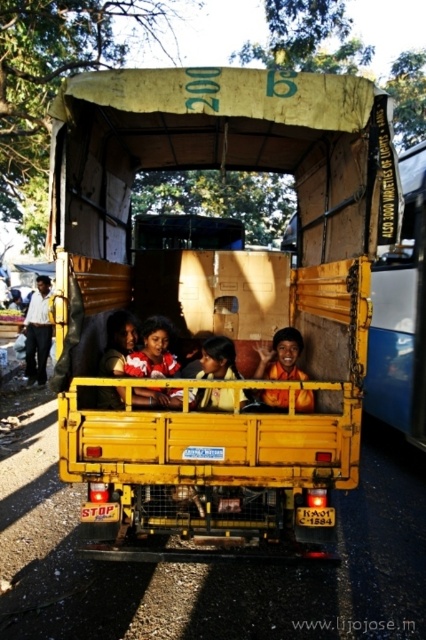
Can you confirm if red and white striped shirt at center is bigger than white cotton shirt at left?

Yes.

Who is shorter, red and white striped shirt at center or white cotton shirt at left?

With less height is white cotton shirt at left.

Is point (144, 323) more distant than point (46, 346)?

No, (144, 323) is closer to viewer.

Identify the location of red and white striped shirt at center. (152, 352).

Is orange cloth at center positioned behind white cotton shirt at left?

No, orange cloth at center is closer to the viewer.

Between point (294, 333) and point (36, 324), which one is positioned in front?

Positioned in front is point (294, 333).

Is point (258, 353) positioned behind point (40, 378)?

No, (258, 353) is closer to viewer.

Locate an element on the screen. orange cloth at center is located at coordinates (281, 356).

Does matte yellow shirt at center have a lesser height compared to white cotton shirt at left?

Indeed, matte yellow shirt at center has a lesser height compared to white cotton shirt at left.

Who is positioned more to the left, matte yellow shirt at center or white cotton shirt at left?

white cotton shirt at left

Between point (224, 372) and point (37, 308), which one is positioned behind?

Positioned behind is point (37, 308).

The width and height of the screenshot is (426, 640). Find the location of `matte yellow shirt at center`. matte yellow shirt at center is located at coordinates pyautogui.click(x=218, y=358).